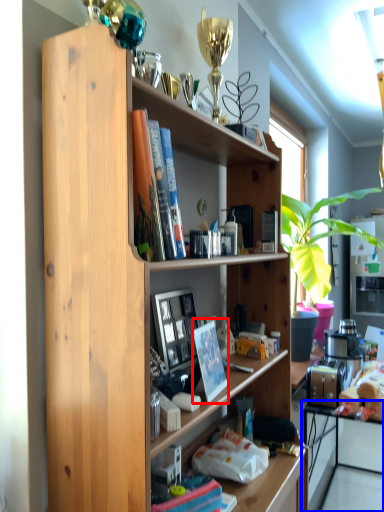
Question: Which point is closer to the camera, paperback book (highlighted by a red box) or computer (highlighted by a blue box)?

Choices:
 (A) paperback book
 (B) computer

Answer: (A)